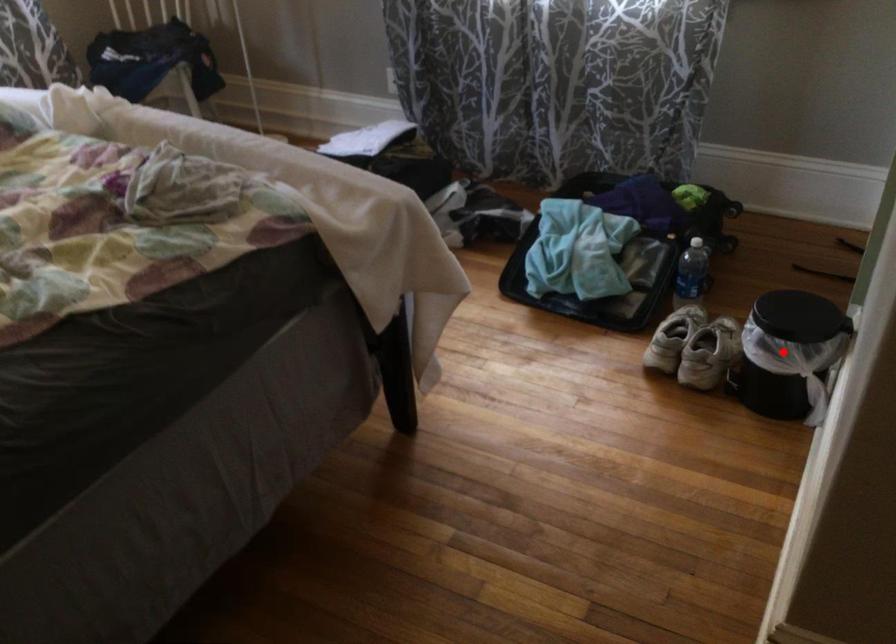
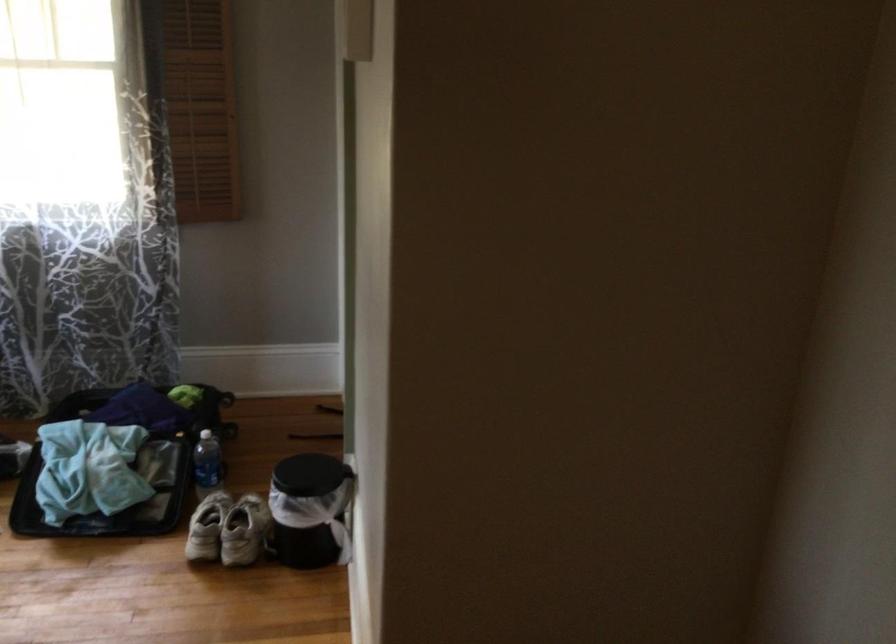
Question: I am providing you with two images of the same scene from different viewpoints. Image1 has a red point marked. In image2, the corresponding 3D location appears at what relative position? Reply with the corresponding letter.

Choices:
 (A) Closer
 (B) Farther

Answer: (B)